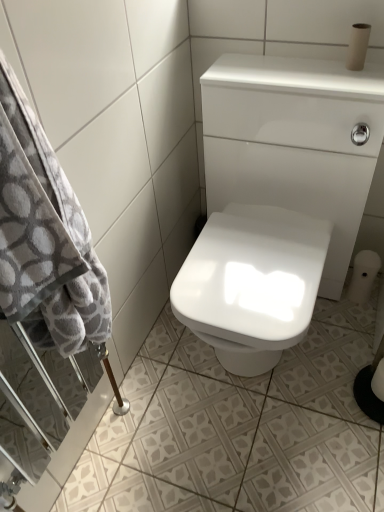
Question: Is matte brown toilet paper at upper right, the 1th toilet paper positioned from the front, at the right side of white glossy sink at center?

Choices:
 (A) no
 (B) yes

Answer: (B)

Question: Is matte brown toilet paper at upper right, positioned as the 3th toilet paper in back-to-front order, shorter than white glossy sink at center?

Choices:
 (A) yes
 (B) no

Answer: (A)

Question: Is matte brown toilet paper at upper right, positioned as the 1th toilet paper in top-to-bottom order, wider than white glossy sink at center?

Choices:
 (A) yes
 (B) no

Answer: (B)

Question: From the image's perspective, is matte brown toilet paper at upper right, positioned as the 1th toilet paper in top-to-bottom order, under white glossy sink at center?

Choices:
 (A) yes
 (B) no

Answer: (B)

Question: Is white glossy sink at center completely or partially inside matte brown toilet paper at upper right, the 1th toilet paper positioned from the front?

Choices:
 (A) yes
 (B) no

Answer: (B)

Question: Is gray soft towel at left wider or thinner than white glossy ceramic tile at lower center?

Choices:
 (A) thin
 (B) wide

Answer: (A)

Question: Considering the positions of gray soft towel at left and white glossy ceramic tile at lower center in the image, is gray soft towel at left taller or shorter than white glossy ceramic tile at lower center?

Choices:
 (A) tall
 (B) short

Answer: (A)

Question: From a real-world perspective, is gray soft towel at left physically located above or below white glossy ceramic tile at lower center?

Choices:
 (A) below
 (B) above

Answer: (B)

Question: Is gray soft towel at left spatially inside white glossy ceramic tile at lower center, or outside of it?

Choices:
 (A) inside
 (B) outside

Answer: (B)

Question: From their relative heights in the image, would you say white glossy ceramic tile at lower center is taller or shorter than white glossy sink at center?

Choices:
 (A) short
 (B) tall

Answer: (A)

Question: In the image, is white glossy ceramic tile at lower center positioned in front of or behind white glossy sink at center?

Choices:
 (A) behind
 (B) front

Answer: (A)

Question: Based on their positions, is white glossy ceramic tile at lower center located to the left or right of white glossy sink at center?

Choices:
 (A) left
 (B) right

Answer: (B)

Question: Is white glossy ceramic tile at lower center bigger or smaller than white glossy sink at center?

Choices:
 (A) big
 (B) small

Answer: (B)

Question: Looking at their shapes, would you say gray soft towel at left is wider or thinner than white matte toilet paper at lower right, the 2th toilet paper from the back?

Choices:
 (A) wide
 (B) thin

Answer: (A)

Question: From a real-world perspective, relative to white matte toilet paper at lower right, positioned as the first toilet paper in bottom-to-top order, is gray soft towel at left vertically above or below?

Choices:
 (A) below
 (B) above

Answer: (B)